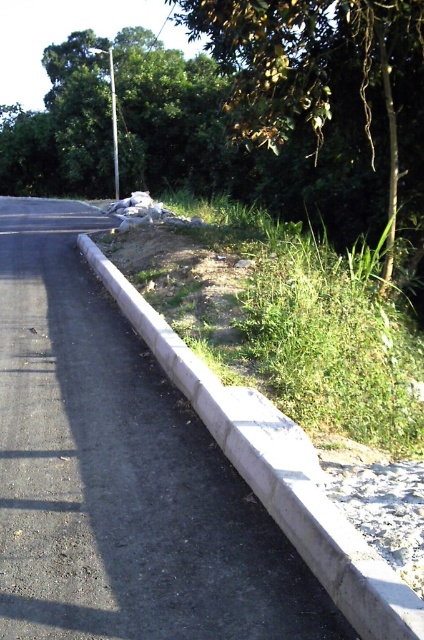
Question: Does green leafy tree at upper center have a lesser width compared to gray concrete curb at center?

Choices:
 (A) no
 (B) yes

Answer: (A)

Question: Which of these objects is positioned closest to the gray concrete curb at center?

Choices:
 (A) green leafy tree at upper center
 (B) metallic pole at upper center

Answer: (A)

Question: Is green leafy tree at upper center to the right of gray concrete curb at center from the viewer's perspective?

Choices:
 (A) no
 (B) yes

Answer: (B)

Question: Based on their relative distances, which object is nearer to the gray concrete curb at center?

Choices:
 (A) metallic pole at upper center
 (B) green leafy tree at upper center

Answer: (B)

Question: Is green leafy tree at upper center positioned in front of gray concrete curb at center?

Choices:
 (A) no
 (B) yes

Answer: (A)

Question: Estimate the real-world distances between objects in this image. Which object is farther from the green leafy tree at upper center?

Choices:
 (A) gray concrete curb at center
 (B) metallic pole at upper center

Answer: (B)